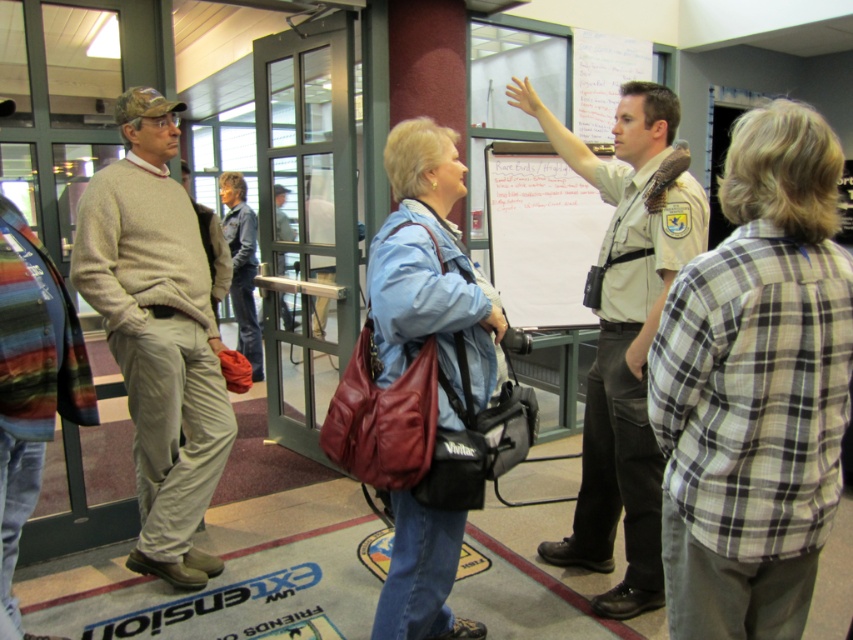
Consider the image. You are standing in the room and want to hand a document to the person wearing the striped wool sweater at left. The document is currently on the white paper at center. Can you reach the document without moving from your current position?

The striped wool sweater at left is taller than the white paper at center, so yes, the person can reach the document without moving because the sweater is higher up.

You are a photographer trying to capture a group photo of the light gray sweater at left and the denim jacket at center. If you want to ensure both subjects are in focus, which subject should you adjust your camera focus on first based on their sizes?

The light gray sweater at left has a larger width than the denim jacket at center, so you should focus on the light gray sweater at left first to ensure proper depth of field coverage for both subjects.

You are a photographer trying to capture a candid shot of the light gray sweater at left and the denim jacket at center. Since you want both subjects to be in focus, you need to know which one is taller. Can you determine which is taller?

The light gray sweater at left is much taller than the denim jacket at center, so you should focus on the light gray sweater at left first to ensure both are in focus.